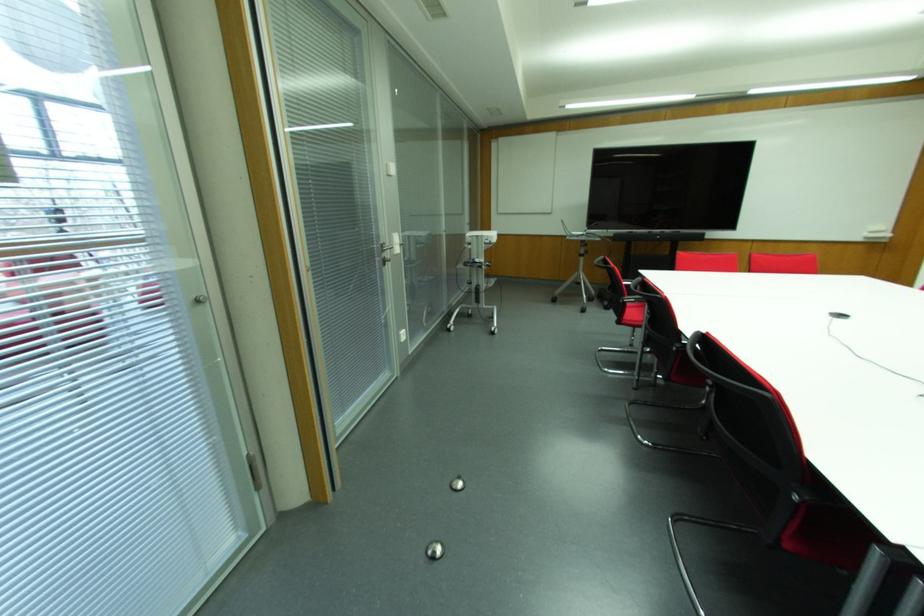
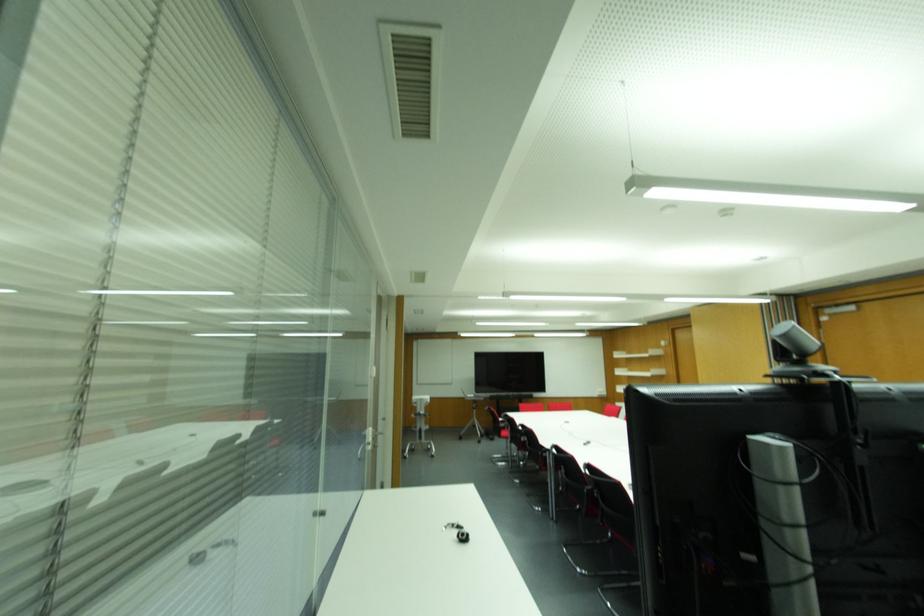
Where in the second image is the point corresponding to point 581,257 from the first image?

(473, 410)